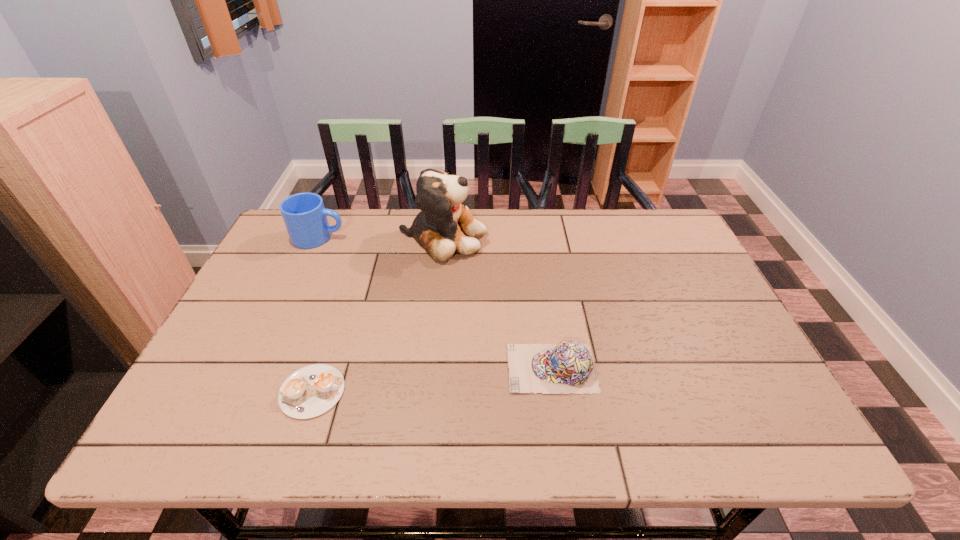
The image size is (960, 540). In order to click on vacant space at the right edge in this screenshot , I will do `click(766, 389)`.

Identify the location of free space at the far left corner of the desktop. (284, 239).

Find the location of `vacant area between the mug and the second object from right to left`. vacant area between the mug and the second object from right to left is located at coordinates (381, 237).

Locate an element on the screen. Image resolution: width=960 pixels, height=540 pixels. vacant area that lies between the puppy and the shortest object is located at coordinates (377, 314).

Find the location of `vacant point located between the shortest object and the rightmost object`. vacant point located between the shortest object and the rightmost object is located at coordinates (432, 380).

Locate an element on the screen. empty location between the mug and the third object from left to right is located at coordinates pos(381,237).

Where is `empty space between the tallest object and the cap`? This screenshot has height=540, width=960. empty space between the tallest object and the cap is located at coordinates (497, 303).

Where is `free space between the second object from right to left and the shortest object`? The height and width of the screenshot is (540, 960). free space between the second object from right to left and the shortest object is located at coordinates (377, 314).

You are a GUI agent. You are given a task and a screenshot of the screen. Output one action in this format:
    pyautogui.click(x=<x>, y=<y>)
    Task: Click on the free spot between the shortest object and the puppy
    The width and height of the screenshot is (960, 540).
    Given the screenshot: What is the action you would take?
    pyautogui.click(x=377, y=314)

Locate an element on the screen. Image resolution: width=960 pixels, height=540 pixels. free area in between the rightmost object and the mug is located at coordinates (435, 303).